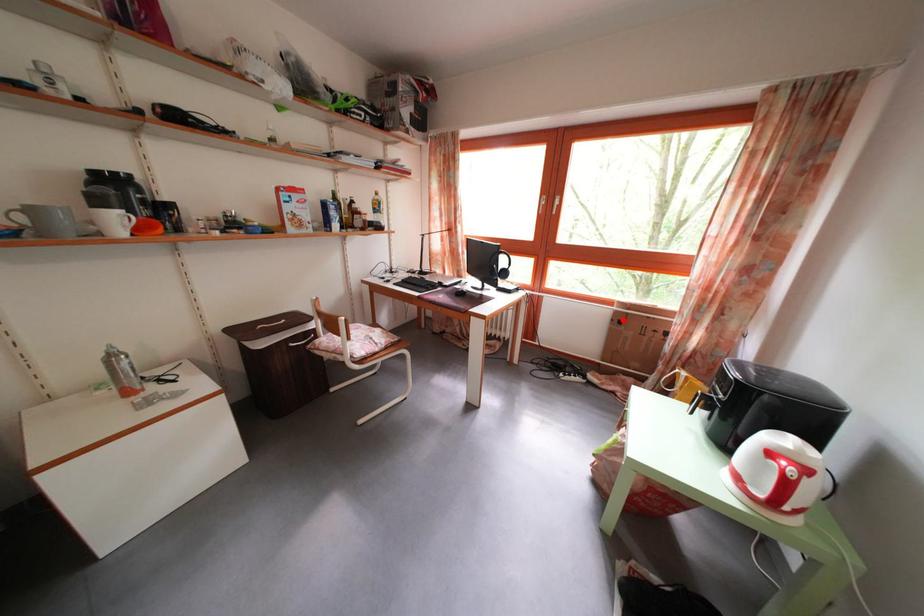
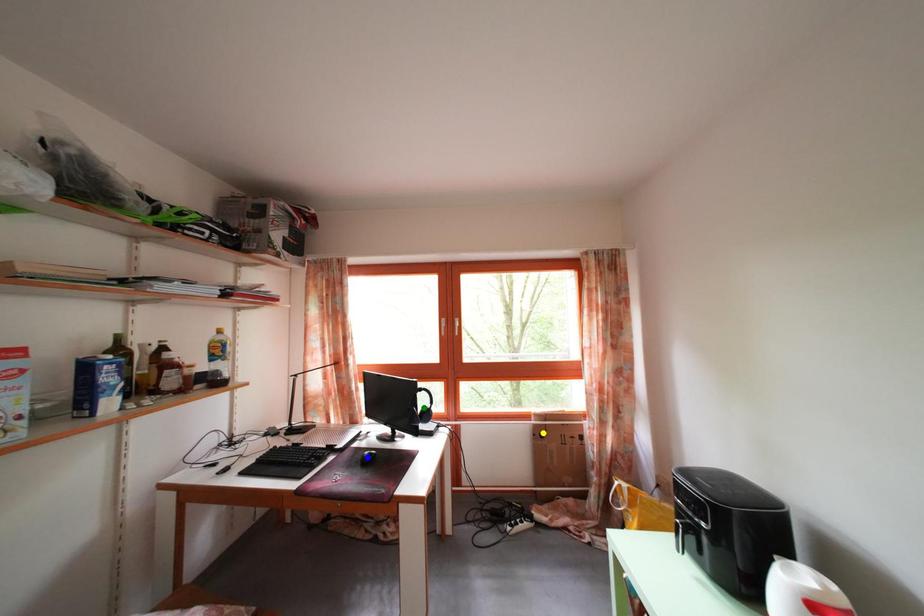
Question: I am providing you with two images of the same scene from different viewpoints. A red point is marked on the first image. You are given multiple points on the second image. Which spot in image 2 lines up with the point in image 1?

Choices:
 (A) green point
 (B) yellow point
 (C) blue point

Answer: (B)